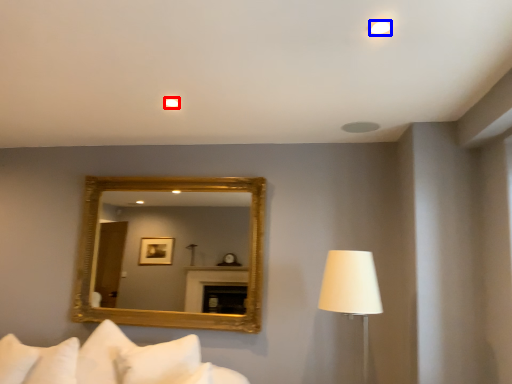
Question: Which object appears closest to the camera in this image, lighting (highlighted by a red box) or lighting (highlighted by a blue box)?

Choices:
 (A) lighting
 (B) lighting

Answer: (B)